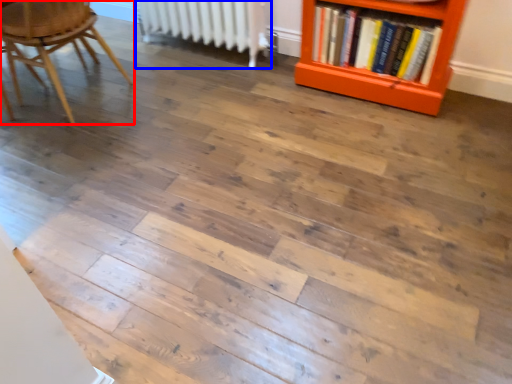
Question: Which point is closer to the camera, chair (highlighted by a red box) or radiator (highlighted by a blue box)?

Choices:
 (A) chair
 (B) radiator

Answer: (A)